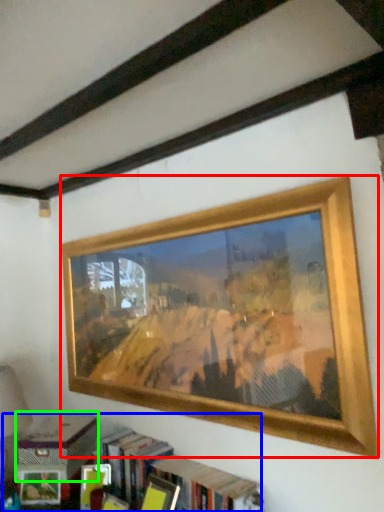
Question: Estimate the real-world distances between objects in this image. Which object is farther from picture frame (highlighted by a red box), bookcase (highlighted by a blue box) or paperback book (highlighted by a green box)?

Choices:
 (A) bookcase
 (B) paperback book

Answer: (B)